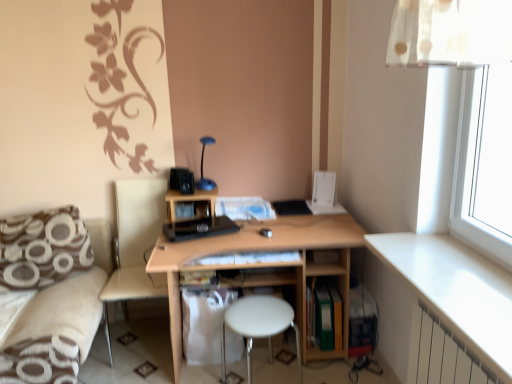
Question: Which direction should I rotate to look at white paper at center, which is counted as the 2th book, starting from the left, — up or down?

Choices:
 (A) up
 (B) down

Answer: (B)

Question: Considering the relative sizes of white plastic stool at center and blue glossy table lamp at upper center in the image provided, is white plastic stool at center shorter than blue glossy table lamp at upper center?

Choices:
 (A) yes
 (B) no

Answer: (B)

Question: Is white plastic stool at center outside of blue glossy table lamp at upper center?

Choices:
 (A) yes
 (B) no

Answer: (A)

Question: Can you confirm if white plastic stool at center is taller than blue glossy table lamp at upper center?

Choices:
 (A) yes
 (B) no

Answer: (A)

Question: Is white plastic stool at center in contact with blue glossy table lamp at upper center?

Choices:
 (A) yes
 (B) no

Answer: (B)

Question: Considering the relative sizes of white plastic stool at center and blue glossy table lamp at upper center in the image provided, is white plastic stool at center bigger than blue glossy table lamp at upper center?

Choices:
 (A) no
 (B) yes

Answer: (B)

Question: Is white plastic stool at center not close to blue glossy table lamp at upper center?

Choices:
 (A) yes
 (B) no

Answer: (B)

Question: Is beige fabric swivel chair at lower left at the back of brown printed fabric pillow at lower left?

Choices:
 (A) yes
 (B) no

Answer: (B)

Question: Does brown printed fabric pillow at lower left have a larger size compared to beige fabric swivel chair at lower left?

Choices:
 (A) yes
 (B) no

Answer: (B)

Question: Can you confirm if brown printed fabric pillow at lower left is taller than beige fabric swivel chair at lower left?

Choices:
 (A) yes
 (B) no

Answer: (B)

Question: From a real-world perspective, is brown printed fabric pillow at lower left over beige fabric swivel chair at lower left?

Choices:
 (A) no
 (B) yes

Answer: (B)

Question: Is the surface of brown printed fabric pillow at lower left in direct contact with beige fabric swivel chair at lower left?

Choices:
 (A) no
 (B) yes

Answer: (A)

Question: From the image's perspective, is brown printed fabric pillow at lower left under beige fabric swivel chair at lower left?

Choices:
 (A) no
 (B) yes

Answer: (A)

Question: Is white metallic radiator at lower right positioned before blue glossy table lamp at upper center?

Choices:
 (A) yes
 (B) no

Answer: (A)